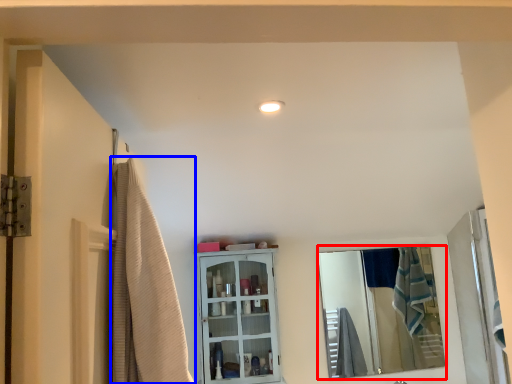
Question: Which of the following is the closest to the observer, mirror (highlighted by a red box) or shower curtain (highlighted by a blue box)?

Choices:
 (A) mirror
 (B) shower curtain

Answer: (B)